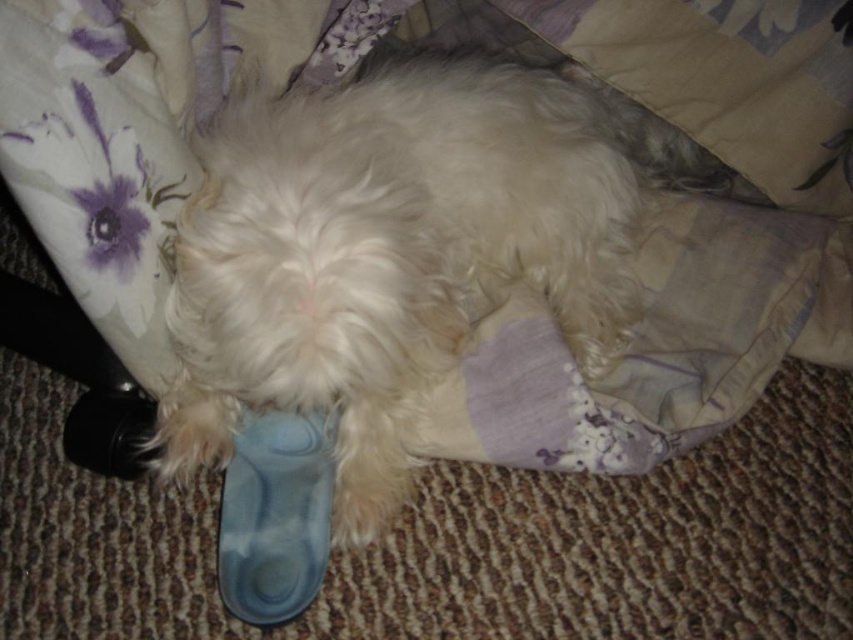
Does white fluffy dog at center have a greater width compared to blue rubber shoe at lower center?

Yes.

From the picture: Who is positioned more to the left, white fluffy dog at center or blue rubber shoe at lower center?

From the viewer's perspective, blue rubber shoe at lower center appears more on the left side.

Which is in front, point (679, 163) or point (305, 506)?

Point (305, 506) is in front.

Identify the location of white fluffy dog at center. This screenshot has height=640, width=853. (399, 248).